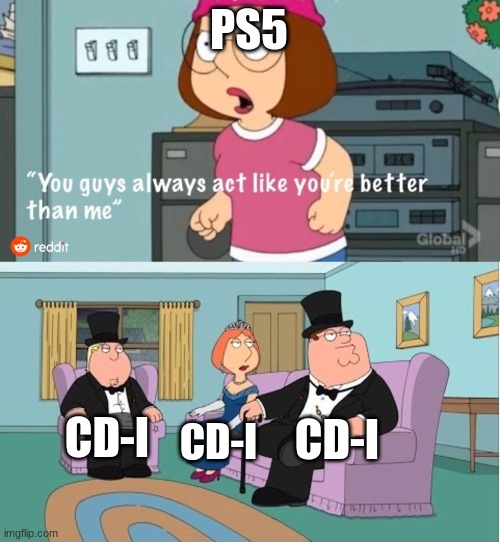
Locate an element on the screen. Image resolution: width=500 pixels, height=542 pixels. window is located at coordinates (147, 335).